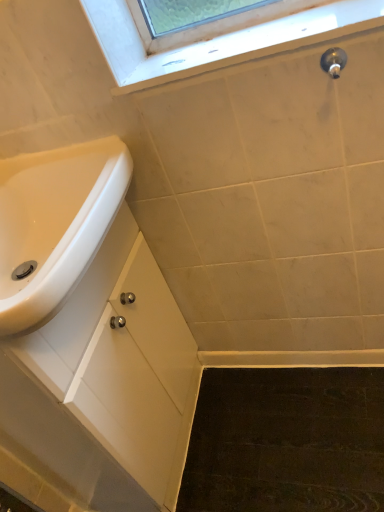
Locate an element on the screen. The height and width of the screenshot is (512, 384). white matte cabinet at lower left is located at coordinates (106, 381).

This screenshot has height=512, width=384. What are the coordinates of `clear glass window at upper center` in the screenshot? It's located at (218, 40).

This screenshot has width=384, height=512. Find the location of `white matte cabinet at lower left`. white matte cabinet at lower left is located at coordinates (106, 381).

Considering the positions of point (340, 66) and point (10, 163), is point (340, 66) closer or farther from the camera than point (10, 163)?

Point (340, 66).

Where is `sink beneath the polished chrome faucet at upper right (from a real-world perspective)`? The height and width of the screenshot is (512, 384). sink beneath the polished chrome faucet at upper right (from a real-world perspective) is located at coordinates (54, 224).

From the picture: From a real-world perspective, which is physically below, polished chrome faucet at upper right or white glossy sink at lower left?

In real-world perspective, white glossy sink at lower left is lower.

Is polished chrome faucet at upper right far from white glossy sink at lower left?

No, polished chrome faucet at upper right is in close proximity to white glossy sink at lower left.

From the image's perspective, which one is positioned higher, white glossy sink at lower left or polished chrome faucet at upper right?

polished chrome faucet at upper right appears higher in the image.

Which object is further away from the camera taking this photo, white glossy sink at lower left or polished chrome faucet at upper right?

polished chrome faucet at upper right is further away from the camera.

This screenshot has height=512, width=384. I want to click on sink in front of the polished chrome faucet at upper right, so click(54, 224).

Is polished chrome faucet at upper right at the back of white glossy sink at lower left?

No, white glossy sink at lower left is not facing away from polished chrome faucet at upper right.

In the scene shown: From a real-world perspective, who is located lower, polished chrome faucet at upper right or clear glass window at upper center?

polished chrome faucet at upper right is physically lower.

What's the angular difference between polished chrome faucet at upper right and clear glass window at upper center's facing directions?

The angle between the facing direction of polished chrome faucet at upper right and the facing direction of clear glass window at upper center is 1.27 degrees.

From the image's perspective, does polished chrome faucet at upper right appear lower than clear glass window at upper center?

Yes, from the image's perspective, polished chrome faucet at upper right is beneath clear glass window at upper center.

Considering the sizes of polished chrome faucet at upper right and clear glass window at upper center in the image, is polished chrome faucet at upper right bigger or smaller than clear glass window at upper center?

In the image, polished chrome faucet at upper right appears to be smaller than clear glass window at upper center.

From a real-world perspective, does polished chrome faucet at upper right sit lower than white matte cabinet at lower left?

Actually, polished chrome faucet at upper right is physically above white matte cabinet at lower left in the real world.

Is polished chrome faucet at upper right bigger than white matte cabinet at lower left?

Incorrect, polished chrome faucet at upper right is not larger than white matte cabinet at lower left.

Considering the sizes of polished chrome faucet at upper right and white matte cabinet at lower left in the image, is polished chrome faucet at upper right taller or shorter than white matte cabinet at lower left?

polished chrome faucet at upper right is shorter than white matte cabinet at lower left.

Which is behind, polished chrome faucet at upper right or white matte cabinet at lower left?

Positioned behind is polished chrome faucet at upper right.

You are a GUI agent. You are given a task and a screenshot of the screen. Output one action in this format:
    pyautogui.click(x=<x>, y=<y>)
    Task: Click on the window that appears above the white matte cabinet at lower left (from the image's perspective)
    The width and height of the screenshot is (384, 512).
    Given the screenshot: What is the action you would take?
    pyautogui.click(x=218, y=40)

From the image's perspective, is white matte cabinet at lower left under clear glass window at upper center?

Yes.

Consider the image. Considering the relative sizes of white matte cabinet at lower left and clear glass window at upper center in the image provided, is white matte cabinet at lower left taller than clear glass window at upper center?

Indeed, white matte cabinet at lower left has a greater height compared to clear glass window at upper center.

Who is more distant, white glossy sink at lower left or white matte cabinet at lower left?

white matte cabinet at lower left is behind.

Which object is positioned more to the left, white glossy sink at lower left or white matte cabinet at lower left?

white glossy sink at lower left.

Considering the sizes of objects white glossy sink at lower left and white matte cabinet at lower left in the image provided, who is bigger, white glossy sink at lower left or white matte cabinet at lower left?

Bigger between the two is white matte cabinet at lower left.

Based on the photo, which of these two, clear glass window at upper center or white glossy sink at lower left, stands taller?

white glossy sink at lower left.

Who is bigger, clear glass window at upper center or white glossy sink at lower left?

Bigger between the two is white glossy sink at lower left.

Visually, is clear glass window at upper center positioned to the left or to the right of white glossy sink at lower left?

In the image, clear glass window at upper center appears on the right side of white glossy sink at lower left.

What's the angular difference between clear glass window at upper center and white glossy sink at lower left's facing directions?

90.4 degrees separate the facing orientations of clear glass window at upper center and white glossy sink at lower left.

Locate an element on the screen. This screenshot has width=384, height=512. plumbing fixture above the white glossy sink at lower left (from the image's perspective) is located at coordinates (333, 61).

This screenshot has height=512, width=384. I want to click on plumbing fixture above the white glossy sink at lower left (from a real-world perspective), so click(333, 61).

Which object lies further to the anchor point white matte cabinet at lower left, white glossy sink at lower left or clear glass window at upper center?

clear glass window at upper center lies further to white matte cabinet at lower left than the other object.

Estimate the real-world distances between objects in this image. Which object is closer to clear glass window at upper center, polished chrome faucet at upper right or white glossy sink at lower left?

polished chrome faucet at upper right lies closer to clear glass window at upper center than the other object.

Looking at the image, which one is located further to polished chrome faucet at upper right, clear glass window at upper center or white glossy sink at lower left?

white glossy sink at lower left.

Based on their spatial positions, is polished chrome faucet at upper right or white glossy sink at lower left further from white matte cabinet at lower left?

Based on the image, polished chrome faucet at upper right appears to be further to white matte cabinet at lower left.

Based on their spatial positions, is white glossy sink at lower left or clear glass window at upper center closer to polished chrome faucet at upper right?

The object closer to polished chrome faucet at upper right is clear glass window at upper center.

Based on the photo, when comparing their distances from polished chrome faucet at upper right, does clear glass window at upper center or white matte cabinet at lower left seem further?

Among the two, white matte cabinet at lower left is located further to polished chrome faucet at upper right.

Estimate the real-world distances between objects in this image. Which object is further from polished chrome faucet at upper right, white matte cabinet at lower left or white glossy sink at lower left?

white matte cabinet at lower left lies further to polished chrome faucet at upper right than the other object.

Consider the image. Considering their positions, is white matte cabinet at lower left positioned further to clear glass window at upper center than white glossy sink at lower left?

white matte cabinet at lower left is further to clear glass window at upper center.

In order to click on bathroom cabinet between white glossy sink at lower left and polished chrome faucet at upper right in this screenshot , I will do `click(106, 381)`.

This screenshot has width=384, height=512. What are the coordinates of `plumbing fixture between clear glass window at upper center and white matte cabinet at lower left in the up-down direction` in the screenshot? It's located at (333, 61).

Where is `window situated between white glossy sink at lower left and polished chrome faucet at upper right from left to right`? The image size is (384, 512). window situated between white glossy sink at lower left and polished chrome faucet at upper right from left to right is located at coordinates (218, 40).

Find the location of a particular element. sink between clear glass window at upper center and white matte cabinet at lower left vertically is located at coordinates tap(54, 224).